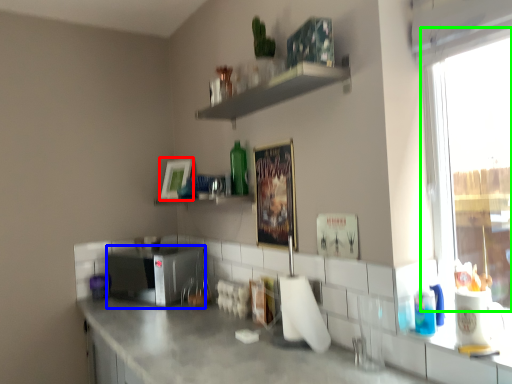
Question: Considering the real-world distances, which object is closest to picture frame (highlighted by a red box)? appliance (highlighted by a blue box) or window (highlighted by a green box).

Choices:
 (A) appliance
 (B) window

Answer: (A)